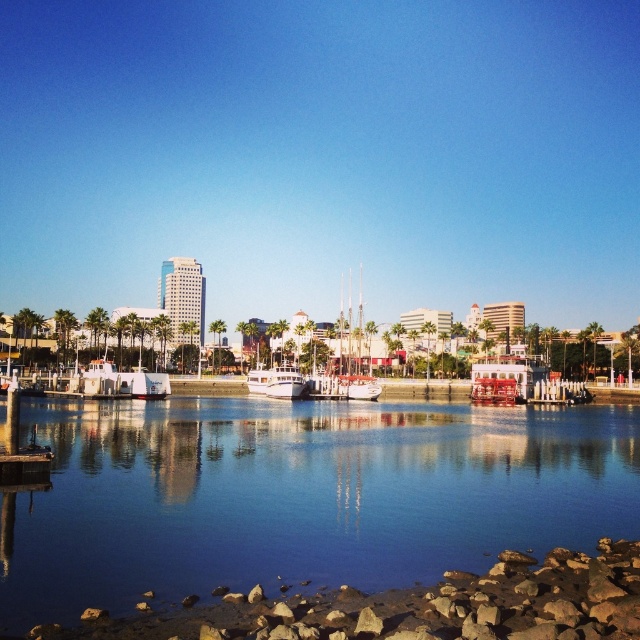
Question: Can you confirm if clear water at center is positioned below white glossy sailboat at center?

Choices:
 (A) no
 (B) yes

Answer: (B)

Question: Estimate the real-world distances between objects in this image. Which object is farther from the white glossy sailboat at center?

Choices:
 (A) white glossy boat at center
 (B) clear water at center

Answer: (B)

Question: Observing the image, what is the correct spatial positioning of clear water at center in reference to white glossy boat at center?

Choices:
 (A) left
 (B) right

Answer: (B)

Question: Which object appears farthest from the camera in this image?

Choices:
 (A) white glossy sailboat at center
 (B) white glossy boat at center

Answer: (A)

Question: Is clear water at center smaller than white glossy boat at center?

Choices:
 (A) no
 (B) yes

Answer: (A)

Question: Among these points, which one is farthest from the camera?

Choices:
 (A) (362, 481)
 (B) (348, 394)

Answer: (B)